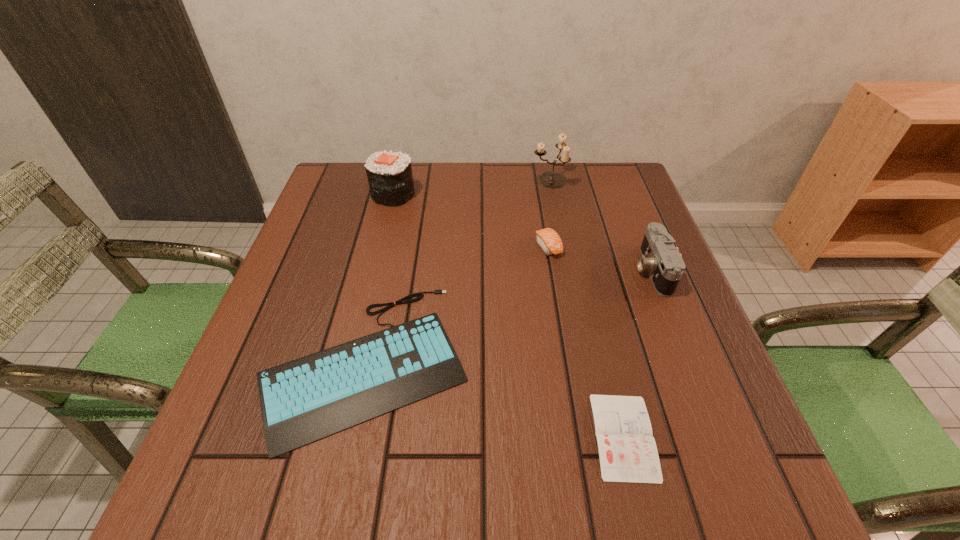
In order to click on free space between the third tallest object and the nearer sushi in this screenshot , I will do `click(600, 258)`.

Identify the location of free space between the diary and the right sushi. (586, 341).

At what (x,y) coordinates should I click in order to perform the action: click on unoccupied area between the shortest object and the left sushi. Please return your answer as a coordinate pair (x, y). Looking at the image, I should click on (509, 315).

Identify the location of free spot between the candle holder and the farther sushi. (471, 187).

Identify the location of free space between the camera and the farther sushi. (522, 232).

Find the location of a particular element. The width and height of the screenshot is (960, 540). object that is the third nearest to the rightmost object is located at coordinates (551, 180).

Where is `the third closest object to the candle holder`? This screenshot has height=540, width=960. the third closest object to the candle holder is located at coordinates (389, 174).

Identify the location of free space that satisfies the following two spatial constraints: 1. on the front side of the taller sushi; 2. on the left side of the third shortest object. The height and width of the screenshot is (540, 960). (380, 246).